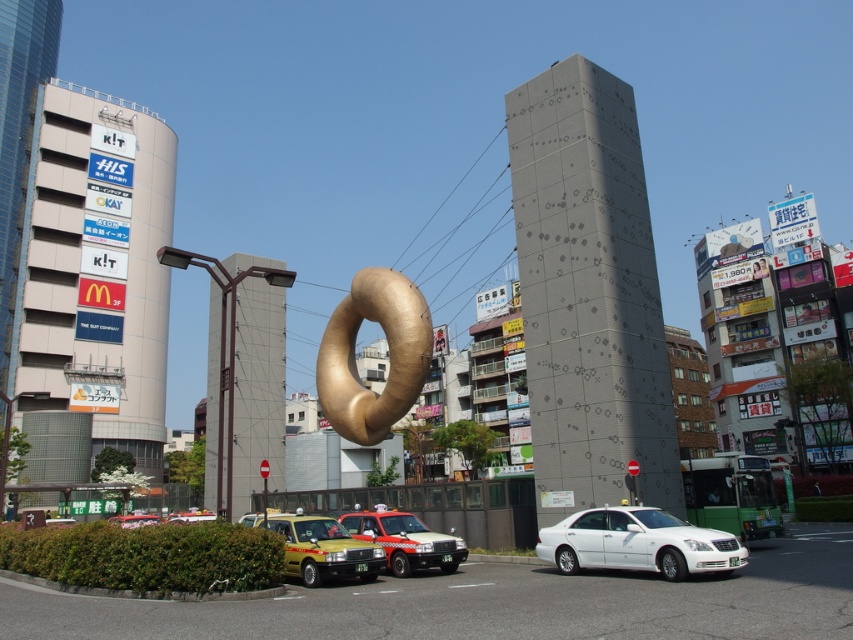
You are a pedestrian standing on the street in the image. You see the white glossy sedan at center and the metallic yellow taxi at lower left. Which vehicle is closer to you?

The metallic yellow taxi at lower left is closer to you because the white glossy sedan at center is positioned over it, indicating it is further away.

You are standing at the point marked as point (387, 355) in the image. What object is exactly at your current location?

The gold metallic donut at center is located at point (387, 355), so the object exactly at your current location is the gold metallic donut at center.